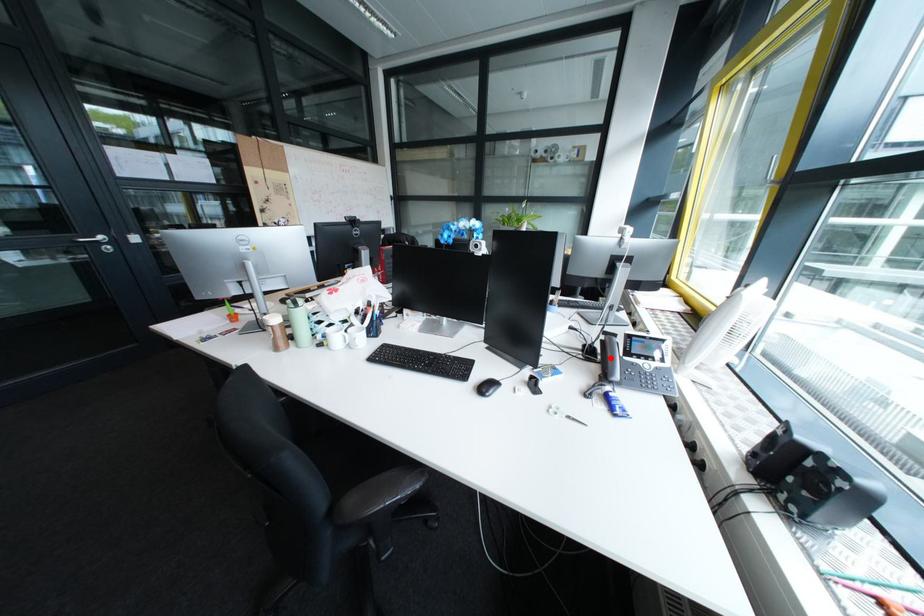
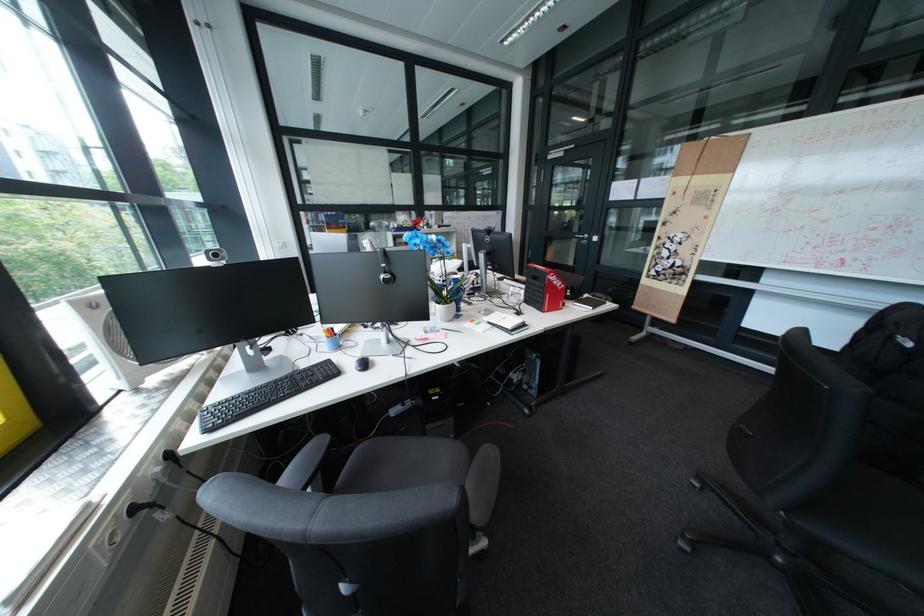
Question: I am providing you with two images of the same scene from different viewpoints. A red point is marked on the first image. Is the red point's position out of view in image 2?

Choices:
 (A) Yes
 (B) No

Answer: (A)